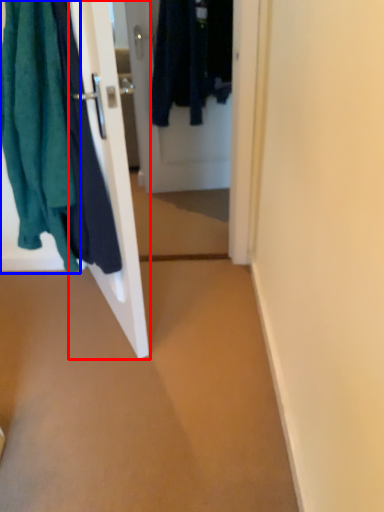
Question: Which object is further to the camera taking this photo, door (highlighted by a red box) or towel (highlighted by a blue box)?

Choices:
 (A) door
 (B) towel

Answer: (A)